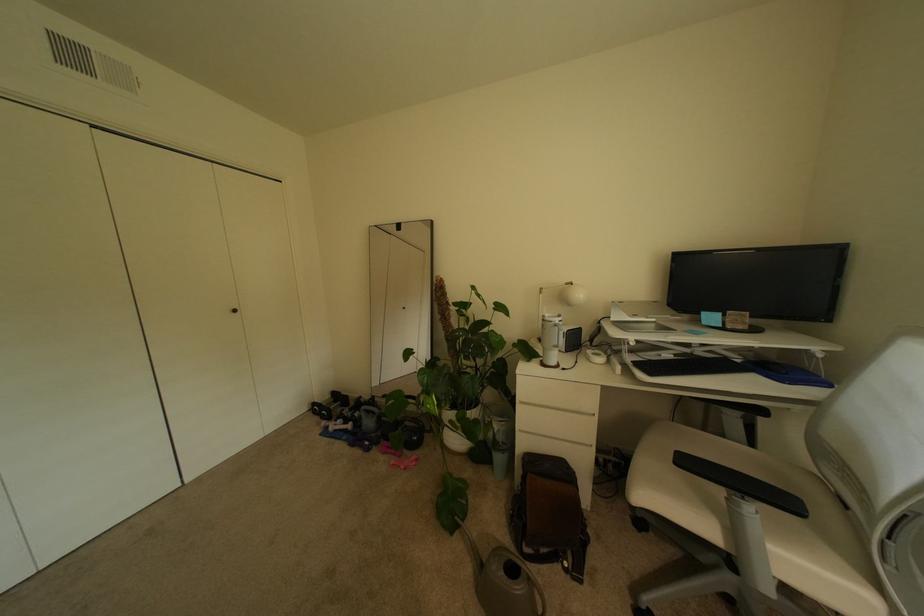
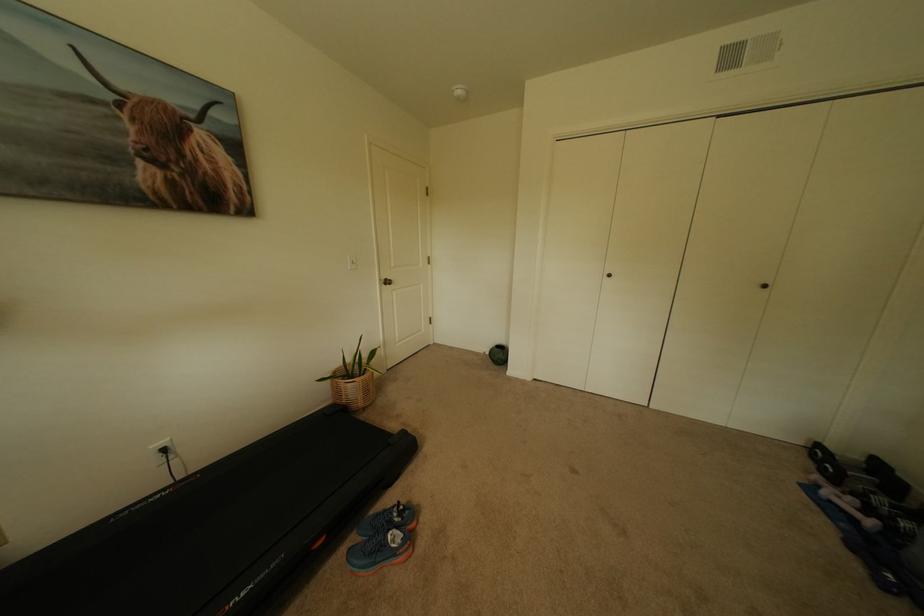
The point at (323, 408) is marked in the first image. Where is the corresponding point in the second image?

(827, 452)